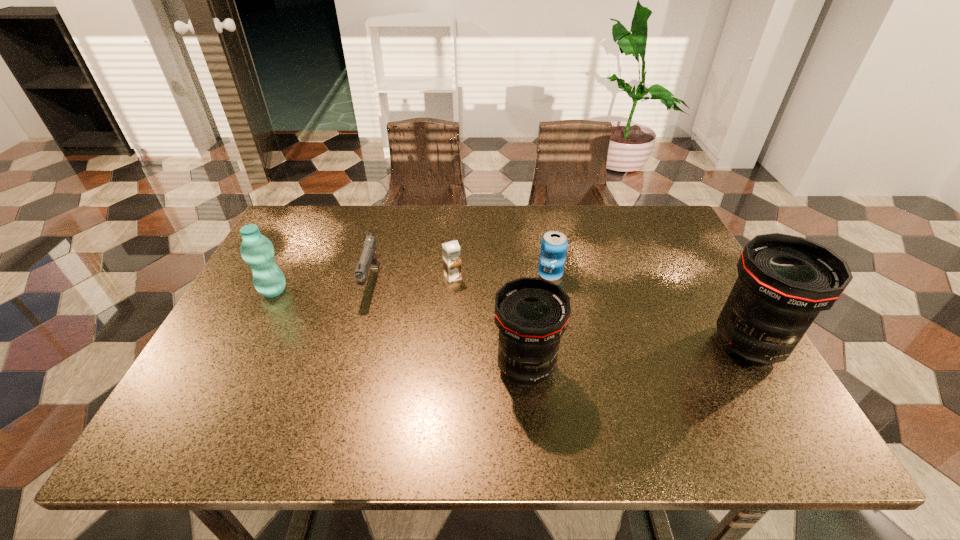
Find the location of a particular element. the shorter telephoto lens is located at coordinates (531, 314).

Locate an element on the screen. Image resolution: width=960 pixels, height=540 pixels. the rightmost object is located at coordinates (784, 281).

The image size is (960, 540). I want to click on the right telephoto lens, so click(784, 281).

Locate an element on the screen. the fifth object from right to left is located at coordinates pyautogui.click(x=369, y=257).

The image size is (960, 540). In order to click on the fourth object from right to left in this screenshot , I will do `click(451, 250)`.

You are a GUI agent. You are given a task and a screenshot of the screen. Output one action in this format:
    pyautogui.click(x=<x>, y=<y>)
    Task: Click on the soda can
    The image size is (960, 540).
    Given the screenshot: What is the action you would take?
    pyautogui.click(x=553, y=250)

Where is `the leftmost object`? This screenshot has height=540, width=960. the leftmost object is located at coordinates (257, 251).

In order to click on free region located 0.260m on the right of the shorter telephoto lens in this screenshot , I will do `click(678, 368)`.

I want to click on vacant area located on the back of the taller telephoto lens, so click(x=684, y=235).

Where is `free location located in the direction the second object from left to right is aimed`? Image resolution: width=960 pixels, height=540 pixels. free location located in the direction the second object from left to right is aimed is located at coordinates (341, 391).